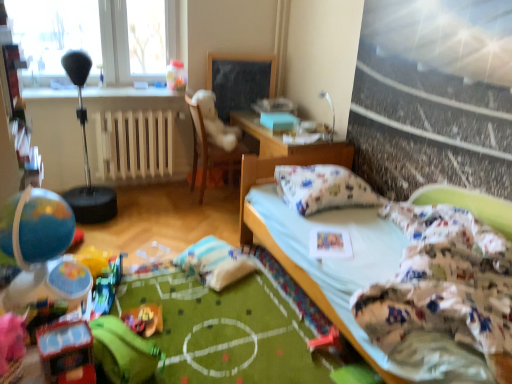
Describe the element at coordinates (144, 319) in the screenshot. I see `plush yellow bear at center, which is counted as the second toy, starting from the back` at that location.

Find the location of a particular element. This screenshot has width=512, height=384. wooden table at center is located at coordinates (279, 159).

Image resolution: width=512 pixels, height=384 pixels. Describe the element at coordinates (176, 75) in the screenshot. I see `translucent plastic container at upper center, which ranks as the 2th toy in left-to-right order` at that location.

How much space does rubber pink toy at lower center, placed as the 5th toy when sorted from top to bottom, occupy horizontally?

7.09 inches.

Locate an element on the screen. This screenshot has height=384, width=512. white cotton pillow at center, the 1th pillow viewed from the right is located at coordinates (322, 188).

Measure the distance between point (205, 176) and camera.

3.86 meters.

This screenshot has height=384, width=512. In order to click on plush yellow bear at center, the second toy in the bottom-to-top sequence in this screenshot , I will do `click(144, 319)`.

Which is more to the right, blue striped pillow at center, the 2th pillow positioned from the top, or white plush bean bag chair at center?

blue striped pillow at center, the 2th pillow positioned from the top.

Does point (244, 271) come behind point (209, 138)?

No, (244, 271) is closer to viewer.

From the image's perspective, is blue striped pillow at center, the 1th pillow positioned from the bottom, under white plush bean bag chair at center?

Correct, blue striped pillow at center, the 1th pillow positioned from the bottom, appears lower than white plush bean bag chair at center in the image.

Does transparent glass window at upper left come in front of blue striped pillow at center, which appears as the first pillow when viewed from the left?

No, transparent glass window at upper left is behind blue striped pillow at center, which appears as the first pillow when viewed from the left.

From the image's perspective, which object appears higher, transparent glass window at upper left or blue striped pillow at center, which appears as the first pillow when viewed from the left?

transparent glass window at upper left.

Which of these two, transparent glass window at upper left or blue striped pillow at center, the 1th pillow positioned from the bottom, is smaller?

Smaller between the two is blue striped pillow at center, the 1th pillow positioned from the bottom.

Considering the relative sizes of plush yellow bear at center, the second toy in the bottom-to-top sequence, and matte plastic globe at left, arranged as the second toy when viewed from the top, in the image provided, is plush yellow bear at center, the second toy in the bottom-to-top sequence, wider than matte plastic globe at left, arranged as the second toy when viewed from the top,?

In fact, plush yellow bear at center, the second toy in the bottom-to-top sequence, might be narrower than matte plastic globe at left, arranged as the second toy when viewed from the top.

Image resolution: width=512 pixels, height=384 pixels. What are the coordinates of `toy that is the 3rd one above the plush yellow bear at center, the 4th toy viewed from the top (from a real-world perspective)` in the screenshot? It's located at (41, 250).

Can you confirm if plush yellow bear at center, the second toy in the bottom-to-top sequence, is smaller than matte plastic globe at left, which is the fourth toy in back-to-front order?

Indeed, plush yellow bear at center, the second toy in the bottom-to-top sequence, has a smaller size compared to matte plastic globe at left, which is the fourth toy in back-to-front order.

In the scene shown: Considering the relative positions of plush yellow bear at center, arranged as the 3th toy when viewed from the right, and matte plastic globe at left, which is the fourth toy in back-to-front order, in the image provided, is plush yellow bear at center, arranged as the 3th toy when viewed from the right, to the left of matte plastic globe at left, which is the fourth toy in back-to-front order, from the viewer's perspective?

Incorrect, plush yellow bear at center, arranged as the 3th toy when viewed from the right, is not on the left side of matte plastic globe at left, which is the fourth toy in back-to-front order.

From the image's perspective, is white plush bean bag chair at center positioned above or below white wooden radiator at center?

white plush bean bag chair at center is situated higher than white wooden radiator at center in the image.

Is white plush bean bag chair at center looking in the opposite direction of white wooden radiator at center?

No, white plush bean bag chair at center's orientation is not away from white wooden radiator at center.

Is white plush bean bag chair at center beside white wooden radiator at center?

white plush bean bag chair at center is not next to white wooden radiator at center, and they're not touching.

Locate an element on the screen. This screenshot has width=512, height=384. radiator behind the white plush bean bag chair at center is located at coordinates (134, 144).

Would you say wooden table at center is a long distance from shiny plastic toy car at lower left, which is the first toy in front-to-back order?

Yes, wooden table at center is far from shiny plastic toy car at lower left, which is the first toy in front-to-back order.

Measure the distance between wooden table at center and shiny plastic toy car at lower left, which appears as the fourth toy when viewed from the left.

1.94 meters.

From a real-world perspective, is wooden table at center beneath shiny plastic toy car at lower left, which is counted as the third toy, starting from the bottom?

Correct, in the physical world, wooden table at center is lower than shiny plastic toy car at lower left, which is counted as the third toy, starting from the bottom.

Does wooden table at center contain shiny plastic toy car at lower left, which is the first toy in front-to-back order?

Definitely not — shiny plastic toy car at lower left, which is the first toy in front-to-back order, is not inside wooden table at center.

Would you say matte plastic globe at left, arranged as the 5th toy when viewed from the right, is a long distance from white cotton pillow at center, marked as the second pillow in a left-to-right arrangement?

Yes, matte plastic globe at left, arranged as the 5th toy when viewed from the right, and white cotton pillow at center, marked as the second pillow in a left-to-right arrangement, are located far from each other.

Based on their sizes in the image, would you say matte plastic globe at left, which is the 4th toy from bottom to top, is bigger or smaller than white cotton pillow at center, acting as the first pillow starting from the top?

Clearly, matte plastic globe at left, which is the 4th toy from bottom to top, is smaller in size than white cotton pillow at center, acting as the first pillow starting from the top.

You are a GUI agent. You are given a task and a screenshot of the screen. Output one action in this format:
    pyautogui.click(x=<x>, y=<y>)
    Task: Click on the toy that is the 3rd object located in front of the white cotton pillow at center, acting as the first pillow starting from the top
    
    Given the screenshot: What is the action you would take?
    pyautogui.click(x=41, y=250)

Visually, is matte plastic globe at left, which is the 4th toy from bottom to top, positioned to the left or to the right of white cotton pillow at center, acting as the first pillow starting from the top?

matte plastic globe at left, which is the 4th toy from bottom to top, is positioned on white cotton pillow at center, acting as the first pillow starting from the top,'s left side.

Can you confirm if white wooden radiator at center is bigger than white cotton pillow at center, which is the 2th pillow from bottom to top?

Yes.

Considering the positions of point (159, 140) and point (312, 200), is point (159, 140) closer or farther from the camera than point (312, 200)?

Point (159, 140) appears to be farther away from the viewer than point (312, 200).

Identify the location of radiator behind the white cotton pillow at center, acting as the first pillow starting from the top. (134, 144).

Consider the image. Is white wooden radiator at center in front of or behind white cotton pillow at center, the 1th pillow viewed from the right, in the image?

In the image, white wooden radiator at center appears behind white cotton pillow at center, the 1th pillow viewed from the right.

At what (x,y) coordinates should I click in order to perform the action: click on bean bag chair behind the blue striped pillow at center, which appears as the first pillow when viewed from the left. Please return your answer as a coordinate pair (x, y). Looking at the image, I should click on (215, 122).

In order to click on window above the blue striped pillow at center, the 2th pillow positioned from the top (from the image's perspective) in this screenshot , I will do `click(96, 38)`.

Which object lies further to the anchor point shiny plastic toy car at lower left, which is counted as the third toy, starting from the bottom, transparent glass window at upper left or translucent plastic container at upper center, positioned as the 5th toy in bottom-to-top order?

The object further to shiny plastic toy car at lower left, which is counted as the third toy, starting from the bottom, is translucent plastic container at upper center, positioned as the 5th toy in bottom-to-top order.

From the picture: From the image, which object appears to be nearer to translucent plastic container at upper center, marked as the first toy in a top-to-bottom arrangement, transparent glass window at upper left or white plush bean bag chair at center?

white plush bean bag chair at center lies closer to translucent plastic container at upper center, marked as the first toy in a top-to-bottom arrangement, than the other object.

Considering their positions, is plush yellow bear at center, the 4th toy viewed from the top, positioned closer to white plush at center than rubber pink toy at lower center, placed as the 5th toy when sorted from top to bottom?

plush yellow bear at center, the 4th toy viewed from the top, is positioned closer to the anchor white plush at center.

Considering their positions, is white plush at center positioned closer to white wooden radiator at center than shiny plastic toy car at lower left, which is counted as the third toy, starting from the top?

white plush at center lies closer to white wooden radiator at center than the other object.

From the image, which object appears to be nearer to plush yellow bear at center, marked as the 3th toy in a left-to-right arrangement, black chalkboard at center or shiny plastic toy car at lower left, which is counted as the third toy, starting from the bottom?

shiny plastic toy car at lower left, which is counted as the third toy, starting from the bottom, is closer to plush yellow bear at center, marked as the 3th toy in a left-to-right arrangement.

Which object lies further to the anchor point blue striped pillow at center, which appears as the first pillow when viewed from the left, plush yellow bear at center, the 4th toy viewed from the top, or white plush at center?

white plush at center lies further to blue striped pillow at center, which appears as the first pillow when viewed from the left, than the other object.

Estimate the real-world distances between objects in this image. Which object is further from white plush bean bag chair at center, wooden table at center or white fabric bed at center?

white fabric bed at center.

Considering their positions, is white wooden radiator at center positioned further to blue striped pillow at center, which appears as the first pillow when viewed from the left, than white cotton pillow at center, acting as the first pillow starting from the top?

Among the two, white wooden radiator at center is located further to blue striped pillow at center, which appears as the first pillow when viewed from the left.

The width and height of the screenshot is (512, 384). What are the coordinates of `bean bag chair between matte plastic globe at left, arranged as the second toy when viewed from the top, and translucent plastic container at upper center, marked as the first toy in a top-to-bottom arrangement, from front to back` in the screenshot? It's located at tap(215, 122).

The width and height of the screenshot is (512, 384). Identify the location of table between transparent glass window at upper left and rubber pink toy at lower center, the 1th toy positioned from the right, from top to bottom. (279, 159).

Identify the location of bean bag chair located between translucent plastic container at upper center, which ranks as the fifth toy in front-to-back order, and black chalkboard at center in the left-right direction. The width and height of the screenshot is (512, 384). (215, 122).

Locate an element on the screen. bean bag chair that lies between transparent glass window at upper left and rubber pink toy at lower center, which is the third toy in back-to-front order, from top to bottom is located at coordinates pyautogui.click(x=215, y=122).